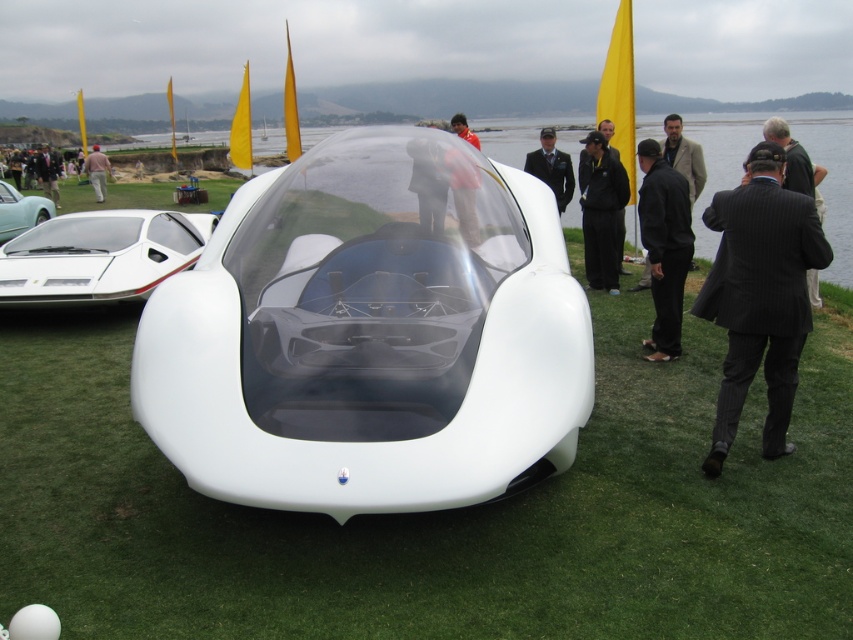
Between point (25, 221) and point (94, 177), which one is positioned behind?

Positioned behind is point (94, 177).

Between matte white car at left and brown leather jacket at center, which one appears on the right side from the viewer's perspective?

Positioned to the right is matte white car at left.

The height and width of the screenshot is (640, 853). What are the coordinates of `matte white car at left` in the screenshot? It's located at (20, 211).

Where is `white matte grass at center`? white matte grass at center is located at coordinates (434, 513).

Where is `white matte grass at center`? The height and width of the screenshot is (640, 853). white matte grass at center is located at coordinates (434, 513).

Who is taller, dark blue suit at center or dark suit at center?

dark suit at center is taller.

Who is positioned more to the left, dark blue suit at center or dark suit at center?

dark suit at center

Identify the location of dark blue suit at center. The image size is (853, 640). (550, 168).

You are a GUI agent. You are given a task and a screenshot of the screen. Output one action in this format:
    pyautogui.click(x=<x>, y=<y>)
    Task: Click on the dark blue suit at center
    
    Given the screenshot: What is the action you would take?
    pyautogui.click(x=550, y=168)